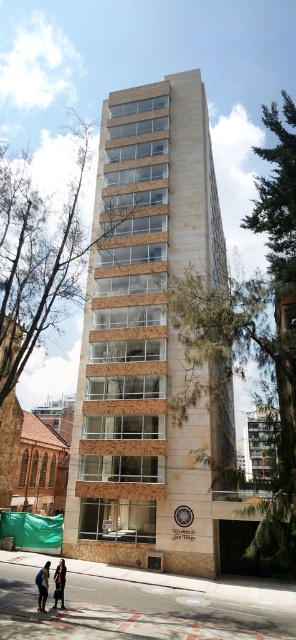
Question: Estimate the real-world distances between objects in this image. Which object is closer to the beige stone building at center?

Choices:
 (A) blue denim jeans at lower left
 (B) dark brown leather jacket at lower left

Answer: (A)

Question: Is beige stone building at center closer to the viewer compared to blue denim jeans at lower left?

Choices:
 (A) no
 (B) yes

Answer: (A)

Question: Which object appears closest to the camera in this image?

Choices:
 (A) beige stone building at center
 (B) blue denim jeans at lower left

Answer: (B)

Question: Among these points, which one is nearest to the camera?

Choices:
 (A) (145, 204)
 (B) (55, 608)

Answer: (B)

Question: Is blue denim jeans at lower left wider than dark brown leather jacket at lower left?

Choices:
 (A) no
 (B) yes

Answer: (B)

Question: In this image, where is beige stone building at center located relative to dark brown leather jacket at lower left?

Choices:
 (A) left
 (B) right

Answer: (B)